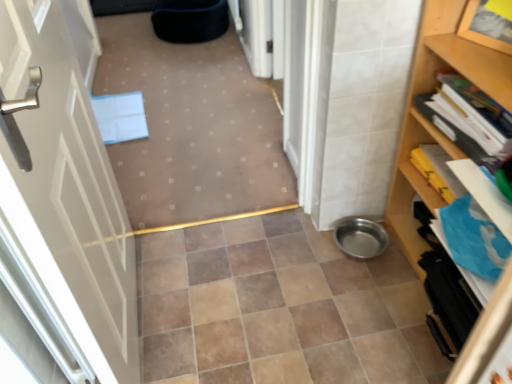
What do you see at coordinates (62, 203) in the screenshot? This screenshot has height=384, width=512. I see `white glossy door at left` at bounding box center [62, 203].

What do you see at coordinates (193, 127) in the screenshot? I see `matte blue folder at center` at bounding box center [193, 127].

Describe the element at coordinates (426, 120) in the screenshot. The image size is (512, 384). I see `wooden bookshelf at right` at that location.

Identify the location of white glossy door at left. This screenshot has width=512, height=384. (62, 203).

Is brown ceramic tile at center next to matte blue folder at center and touching it?

No.

From the image's perspective, is brown ceramic tile at center located above or below matte blue folder at center?

Clearly, from the image's perspective, brown ceramic tile at center is below matte blue folder at center.

Relative to matte blue folder at center, is brown ceramic tile at center in front or behind?

brown ceramic tile at center is positioned farther from the viewer than matte blue folder at center.

Between brown ceramic tile at center and matte blue folder at center, which one has larger width?

brown ceramic tile at center.

Choose the correct answer: Is brown ceramic tile at center inside white glossy door at left or outside it?

brown ceramic tile at center is not enclosed by white glossy door at left.

Between brown ceramic tile at center and white glossy door at left, which one appears on the left side from the viewer's perspective?

From the viewer's perspective, white glossy door at left appears more on the left side.

Which object is more forward, brown ceramic tile at center or white glossy door at left?

white glossy door at left is more forward.

Relative to brown ceramic tile at center, is white glossy door at left in front or behind?

In the image, white glossy door at left appears in front of brown ceramic tile at center.

From a real-world perspective, is white glossy door at left positioned above or below brown ceramic tile at center?

Clearly, from a real-world perspective, white glossy door at left is above brown ceramic tile at center.

Consider the image. Considering the relative positions of white glossy door at left and brown ceramic tile at center in the image provided, is white glossy door at left to the left or to the right of brown ceramic tile at center?

Based on their positions, white glossy door at left is located to the left of brown ceramic tile at center.

Is white glossy door at left with brown ceramic tile at center?

No, white glossy door at left is not touching brown ceramic tile at center.

Which object is positioned more to the left, white glossy door at left or matte blue folder at center?

white glossy door at left is more to the left.

Is white glossy door at left in contact with matte blue folder at center?

No, white glossy door at left is not making contact with matte blue folder at center.

Would you say matte blue folder at center is part of white glossy door at left's contents?

Definitely not — matte blue folder at center is not inside white glossy door at left.

Does white glossy door at left have a lesser height compared to matte blue folder at center?

Incorrect, the height of white glossy door at left does not fall short of that of matte blue folder at center.

Consider the image. Does wooden bookshelf at right turn towards brown ceramic tile at center?

Yes, wooden bookshelf at right is facing brown ceramic tile at center.

Is wooden bookshelf at right next to brown ceramic tile at center?

No, wooden bookshelf at right is not beside brown ceramic tile at center.

From the image's perspective, relative to brown ceramic tile at center, is wooden bookshelf at right above or below?

Based on their image positions, wooden bookshelf at right is located above brown ceramic tile at center.

Considering the positions of points (510, 279) and (367, 287), is point (510, 279) closer to camera compared to point (367, 287)?

Yes, it is in front of point (367, 287).

Can you confirm if wooden bookshelf at right is positioned to the right of white glossy door at left?

Correct, you'll find wooden bookshelf at right to the right of white glossy door at left.

Who is taller, wooden bookshelf at right or white glossy door at left?

white glossy door at left.

Is wooden bookshelf at right located outside white glossy door at left?

A: wooden bookshelf at right lies outside white glossy door at left's area.

From the image's perspective, is wooden bookshelf at right located beneath white glossy door at left?

No, from the image's perspective, wooden bookshelf at right is not below white glossy door at left.

Considering the sizes of objects matte blue folder at center and brown ceramic tile at center in the image provided, who is shorter, matte blue folder at center or brown ceramic tile at center?

brown ceramic tile at center.

From a real-world perspective, who is located higher, matte blue folder at center or brown ceramic tile at center?

In real-world perspective, matte blue folder at center is above.

From the image's perspective, is matte blue folder at center positioned above or below brown ceramic tile at center?

matte blue folder at center is situated higher than brown ceramic tile at center in the image.

Is matte blue folder at center touching brown ceramic tile at center?

No, matte blue folder at center is not making contact with brown ceramic tile at center.

Find the location of a particular element. The height and width of the screenshot is (384, 512). ceramic tile behind the matte blue folder at center is located at coordinates (278, 308).

The width and height of the screenshot is (512, 384). I want to click on door above the brown ceramic tile at center (from a real-world perspective), so click(62, 203).

Based on their spatial positions, is wooden bookshelf at right or brown ceramic tile at center closer to matte blue folder at center?

brown ceramic tile at center is positioned closer to the anchor matte blue folder at center.

From the image, which object appears to be farther from brown ceramic tile at center, white glossy door at left or wooden bookshelf at right?

Among the two, wooden bookshelf at right is located further to brown ceramic tile at center.

Based on their spatial positions, is wooden bookshelf at right or white glossy door at left closer to brown ceramic tile at center?

The object closer to brown ceramic tile at center is white glossy door at left.

Looking at the image, which one is located further to white glossy door at left, wooden bookshelf at right or matte blue folder at center?

Among the two, wooden bookshelf at right is located further to white glossy door at left.

Based on their spatial positions, is matte blue folder at center or wooden bookshelf at right closer to white glossy door at left?

matte blue folder at center is positioned closer to the anchor white glossy door at left.

Estimate the real-world distances between objects in this image. Which object is further from white glossy door at left, wooden bookshelf at right or brown ceramic tile at center?

wooden bookshelf at right lies further to white glossy door at left than the other object.

Based on the photo, considering their positions, is brown ceramic tile at center positioned further to matte blue folder at center than wooden bookshelf at right?

Based on the image, wooden bookshelf at right appears to be further to matte blue folder at center.

From the image, which object appears to be nearer to wooden bookshelf at right, white glossy door at left or brown ceramic tile at center?

brown ceramic tile at center.

You are a GUI agent. You are given a task and a screenshot of the screen. Output one action in this format:
    pyautogui.click(x=<x>, y=<y>)
    Task: Click on the plain between white glossy door at left and wooden bookshelf at right from left to right
    Image resolution: width=512 pixels, height=384 pixels.
    Given the screenshot: What is the action you would take?
    pyautogui.click(x=193, y=127)

What are the coordinates of `ceramic tile between white glossy door at left and wooden bookshelf at right in the horizontal direction` in the screenshot? It's located at (278, 308).

Where is `ceramic tile between matte blue folder at center and wooden bookshelf at right from left to right`? ceramic tile between matte blue folder at center and wooden bookshelf at right from left to right is located at coordinates (278, 308).

At what (x,y) coordinates should I click in order to perform the action: click on plain between white glossy door at left and brown ceramic tile at center in the front-back direction. Please return your answer as a coordinate pair (x, y). Looking at the image, I should click on (193, 127).